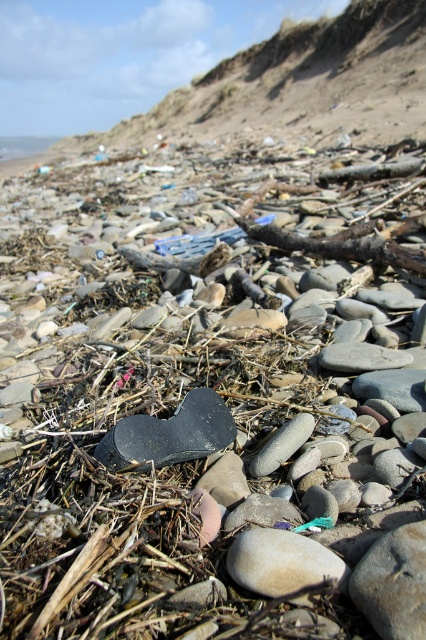
Question: Which of the following is the closest to the observer?

Choices:
 (A) smooth gray rock at center
 (B) smooth beige rock at center
 (C) black matte sandal at center

Answer: (A)

Question: Where is black matte sandal at center located in relation to smooth beige rock at center in the image?

Choices:
 (A) right
 (B) left

Answer: (B)

Question: Which point is farther to the camera?

Choices:
 (A) black matte sandal at center
 (B) smooth gray rock at center
 (C) smooth beige rock at center

Answer: (A)

Question: Can you confirm if black matte sandal at center is bigger than smooth beige rock at center?

Choices:
 (A) no
 (B) yes

Answer: (B)

Question: Does smooth gray rock at center have a greater width compared to smooth beige rock at center?

Choices:
 (A) yes
 (B) no

Answer: (B)

Question: Estimate the real-world distances between objects in this image. Which object is closer to the smooth beige rock at center?

Choices:
 (A) smooth gray rock at center
 (B) black matte sandal at center

Answer: (A)